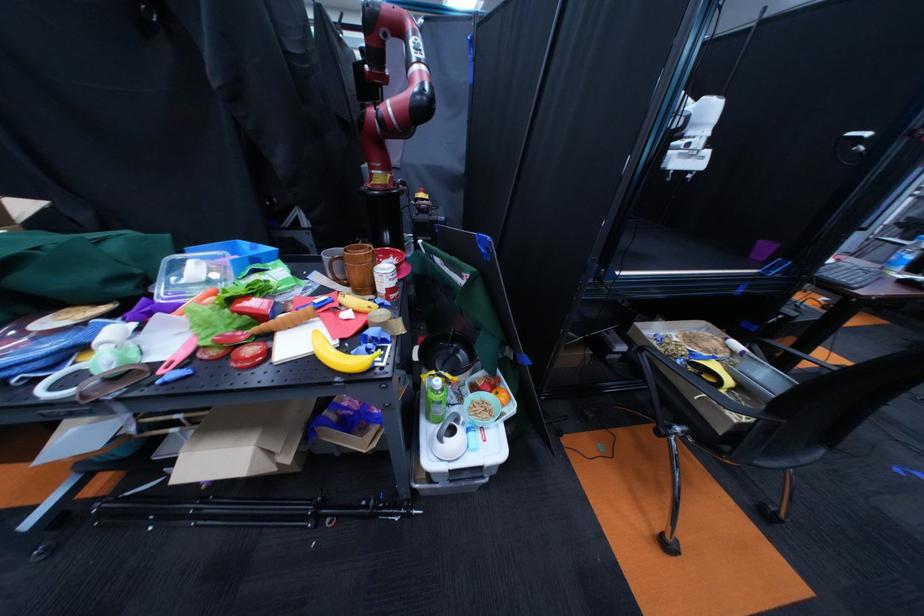
Identify the location of black pan handle. The width and height of the screenshot is (924, 616). (758, 407).